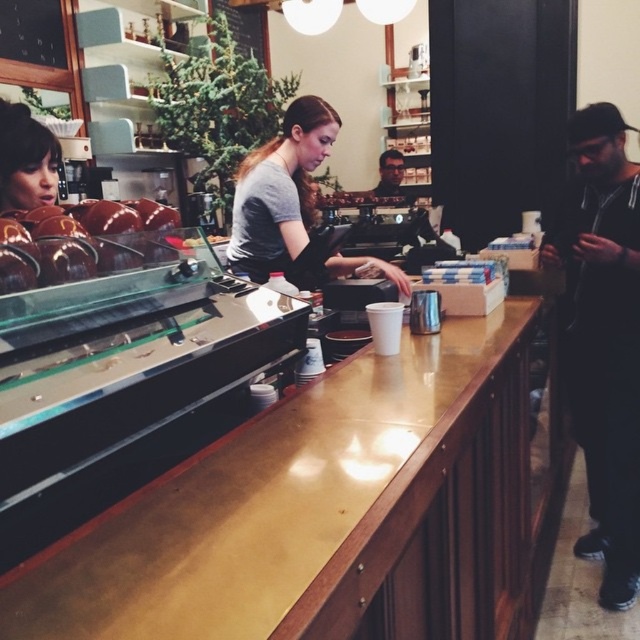
Question: Does black matte jacket at right appear on the left side of chocolate-coated nuts at left?

Choices:
 (A) yes
 (B) no

Answer: (B)

Question: Among these points, which one is nearest to the camera?

Choices:
 (A) (378, 454)
 (B) (266, 161)
 (C) (60, 221)

Answer: (A)

Question: Can you confirm if gold polished wood counter at center is positioned below chocolate-coated nuts at left?

Choices:
 (A) yes
 (B) no

Answer: (A)

Question: Observing the image, what is the correct spatial positioning of chocolate-coated nuts at left in reference to matte black jacket at center?

Choices:
 (A) below
 (B) above

Answer: (A)

Question: Which point appears closest to the camera in this image?

Choices:
 (A) (54, 212)
 (B) (388, 269)

Answer: (A)

Question: Among these points, which one is farthest from the camera?

Choices:
 (A) (56, 240)
 (B) (392, 180)
 (C) (291, 589)
 (D) (272, 252)

Answer: (B)